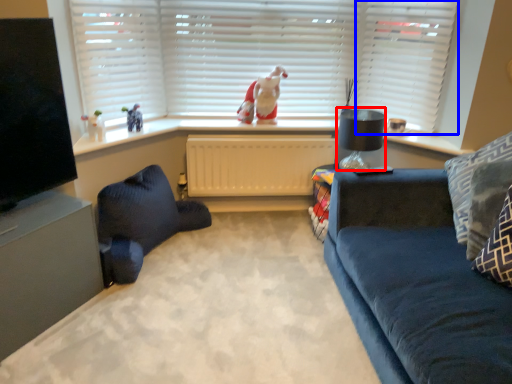
Question: Which of the following is the closest to the observer, lamp (highlighted by a red box) or shutter (highlighted by a blue box)?

Choices:
 (A) lamp
 (B) shutter

Answer: (B)